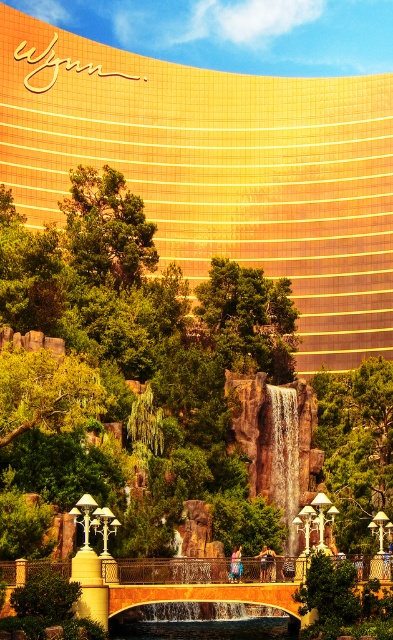
Does gold metallic building at upper center have a larger size compared to golden metallic waterfall at center?

Yes, gold metallic building at upper center is bigger than golden metallic waterfall at center.

Is gold metallic building at upper center to the left of golden metallic waterfall at center from the viewer's perspective?

Indeed, gold metallic building at upper center is positioned on the left side of golden metallic waterfall at center.

The image size is (393, 640). I want to click on gold metallic building at upper center, so click(218, 170).